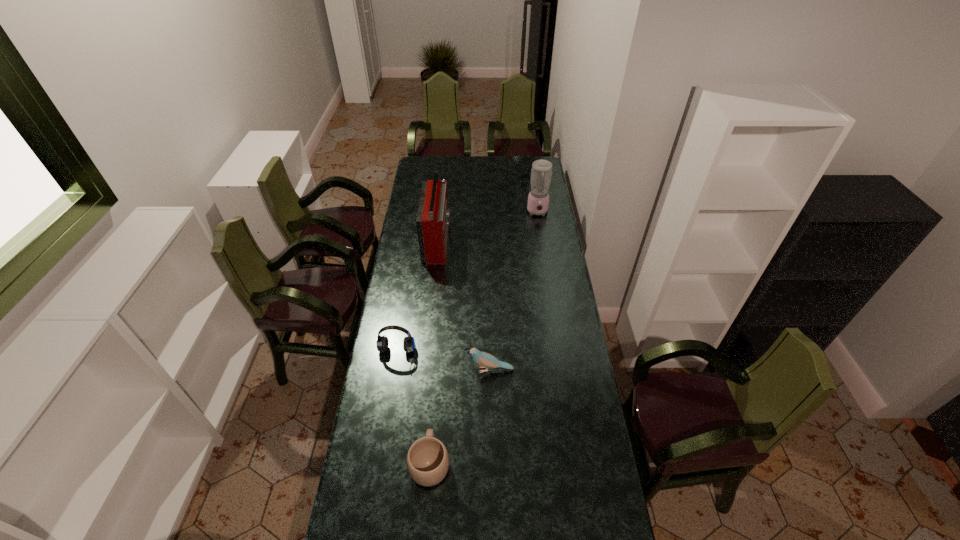
Identify the location of free space between the bird and the headset. (443, 364).

Where is `empty location between the bird and the nearest object`? Image resolution: width=960 pixels, height=540 pixels. empty location between the bird and the nearest object is located at coordinates (460, 416).

Find the location of a particular element. object identified as the closest to the nearest object is located at coordinates (486, 360).

Point out which object is positioned as the fourth nearest to the bird. Please provide its 2D coordinates. Your answer should be formatted as a tuple, i.e. [(x, y)], where the tuple contains the x and y coordinates of a point satisfying the conditions above.

[(538, 199)]

Where is `vacant space that satisfies the following two spatial constraints: 1. on the front-facing side of the radio receiver; 2. on the ear cushions of the headset`? The height and width of the screenshot is (540, 960). vacant space that satisfies the following two spatial constraints: 1. on the front-facing side of the radio receiver; 2. on the ear cushions of the headset is located at coordinates (424, 358).

You are a GUI agent. You are given a task and a screenshot of the screen. Output one action in this format:
    pyautogui.click(x=<x>, y=<y>)
    Task: Click on the vacant region that satisfies the following two spatial constraints: 1. on the side of the shortest object with the handle; 2. on the front-facing side of the radio receiver
    Image resolution: width=960 pixels, height=540 pixels.
    Given the screenshot: What is the action you would take?
    pyautogui.click(x=447, y=241)

Where is `vacant space that satisfies the following two spatial constraints: 1. on the base of the food processor near the control knob; 2. on the front-facing side of the radio receiver`? The image size is (960, 540). vacant space that satisfies the following two spatial constraints: 1. on the base of the food processor near the control knob; 2. on the front-facing side of the radio receiver is located at coordinates (542, 241).

At what (x,y) coordinates should I click in order to perform the action: click on vacant position in the image that satisfies the following two spatial constraints: 1. on the side of the nearest object with the handle; 2. on the front-facing side of the radio receiver. Please return your answer as a coordinate pair (x, y). Looking at the image, I should click on (447, 241).

Identify the location of free space that satisfies the following two spatial constraints: 1. on the side of the nearest object with the handle; 2. on the front-facing side of the radio receiver. The image size is (960, 540). (447, 241).

Image resolution: width=960 pixels, height=540 pixels. Identify the location of vacant space that satisfies the following two spatial constraints: 1. on the side of the shortest object with the handle; 2. on the front-facing side of the radio receiver. (447, 241).